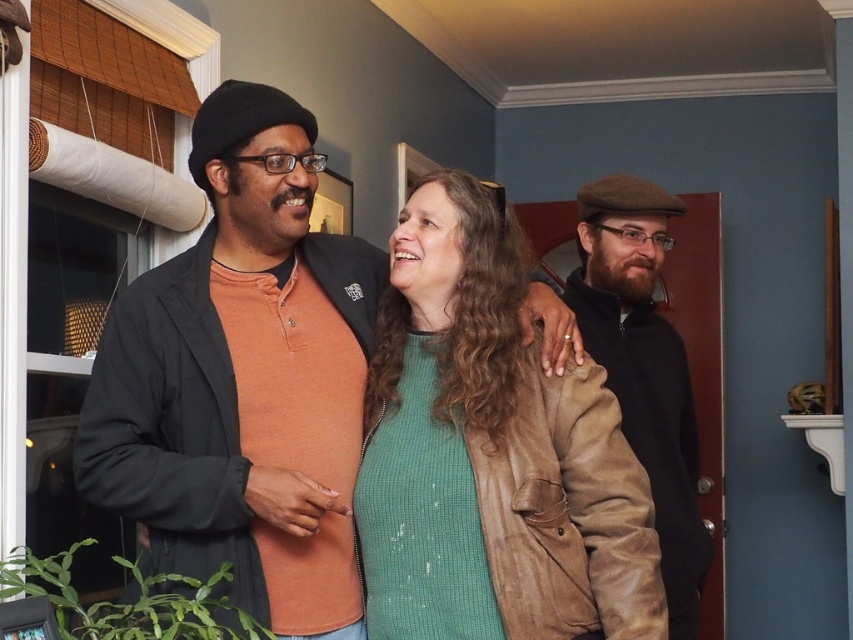
Is brown leather jacket at center to the left of brown suede cap at right from the viewer's perspective?

Indeed, brown leather jacket at center is positioned on the left side of brown suede cap at right.

Between brown leather jacket at center and brown suede cap at right, which one is positioned lower?

brown suede cap at right is below.

Which is in front, point (213, 500) or point (614, 212)?

Point (213, 500) is in front.

At what (x,y) coordinates should I click in order to perform the action: click on brown leather jacket at center. Please return your answer as a coordinate pair (x, y). Looking at the image, I should click on (241, 380).

Can you confirm if brown leather jacket at center is thinner than green textured sweater at center?

Indeed, brown leather jacket at center has a lesser width compared to green textured sweater at center.

Is brown leather jacket at center behind green textured sweater at center?

Yes, it is behind green textured sweater at center.

Who is more forward, [252,458] or [473,509]?

Point [473,509]

Find the location of `brown leather jacket at center`. brown leather jacket at center is located at coordinates (241, 380).

Measure the distance between green textured sweater at center and brown suede cap at right.

They are 21.50 inches apart.

Is point (515, 438) less distant than point (646, 372)?

Yes.

Locate an element on the screen. The width and height of the screenshot is (853, 640). green textured sweater at center is located at coordinates (490, 452).